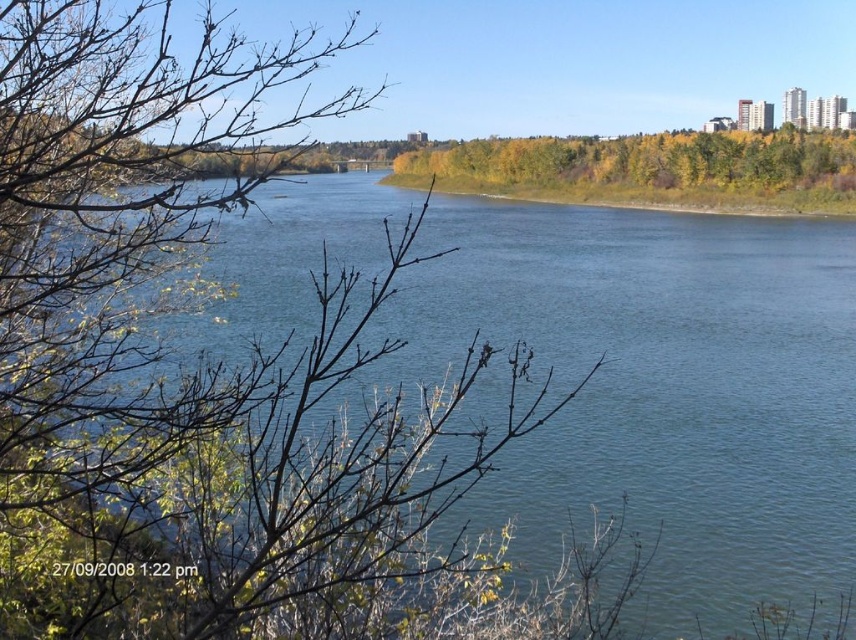
Locate an element on the screen. green leafy trees at center is located at coordinates (645, 161).

Between green leafy trees at center and green leafy vegetation at center, which one appears on the left side from the viewer's perspective?

green leafy vegetation at center

Who is more forward, (631, 147) or (488, 189)?

Point (488, 189) is in front.

Where is `green leafy trees at center`? Image resolution: width=856 pixels, height=640 pixels. green leafy trees at center is located at coordinates (645, 161).

Who is positioned more to the right, blue water at center or green leafy trees at center?

Positioned to the right is green leafy trees at center.

Does point (482, 404) come farther from viewer compared to point (676, 152)?

No, it is not.

Between point (506, 497) and point (770, 172), which one is positioned in front?

Point (506, 497)

This screenshot has height=640, width=856. Identify the location of blue water at center. (664, 385).

What do you see at coordinates (664, 385) in the screenshot? Image resolution: width=856 pixels, height=640 pixels. I see `blue water at center` at bounding box center [664, 385].

Which of these two, blue water at center or green leafy vegetation at center, stands shorter?

green leafy vegetation at center

Where is `blue water at center`? The height and width of the screenshot is (640, 856). blue water at center is located at coordinates (664, 385).